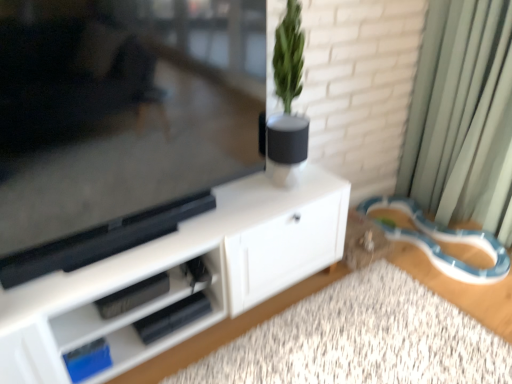
Question: Considering the positions of point (32, 337) and point (476, 51), is point (32, 337) closer or farther from the camera than point (476, 51)?

Choices:
 (A) farther
 (B) closer

Answer: (B)

Question: From a real-world perspective, is white matte cabinet at center positioned above or below green fabric curtain at right?

Choices:
 (A) above
 (B) below

Answer: (B)

Question: Estimate the real-world distances between objects in this image. Which object is farther from the green matte plant at upper center?

Choices:
 (A) green fabric curtain at right
 (B) white matte cabinet at center
 (C) blue plastic leash at lower right
 (D) white matte vase at center
 (E) white matte carpet at lower center

Answer: (C)

Question: Which object is the closest to the green fabric curtain at right?

Choices:
 (A) green matte plant at upper center
 (B) white matte cabinet at center
 (C) white matte carpet at lower center
 (D) white matte vase at center
 (E) blue plastic leash at lower right

Answer: (E)